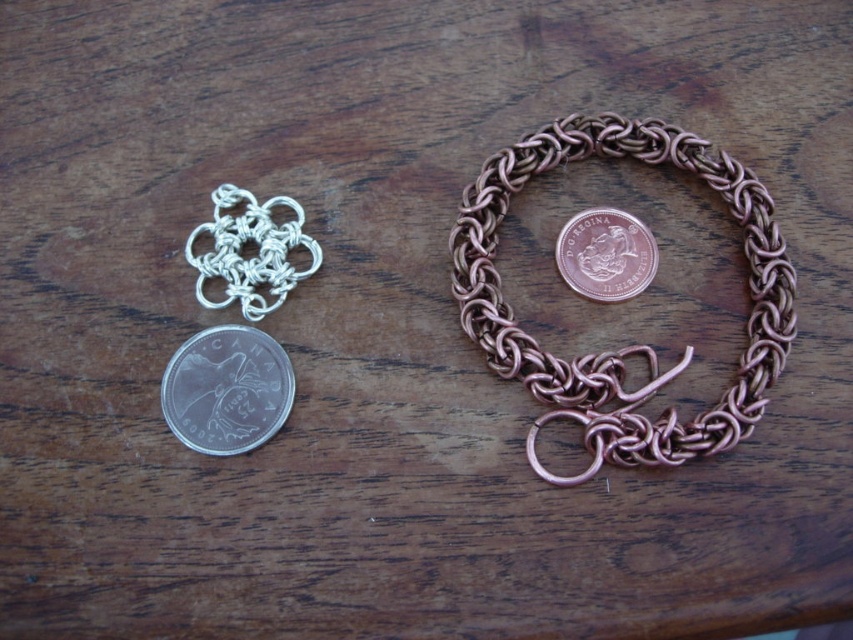
Question: Which of the following is the closest to the observer?

Choices:
 (A) rose gold metallic coin at center
 (B) silver/metallic chain at center

Answer: (B)

Question: In this image, where is silver metallic coin at lower left located relative to silver/metallic chain at center?

Choices:
 (A) left
 (B) right

Answer: (A)

Question: Which of the following is the closest to the observer?

Choices:
 (A) (608, 243)
 (B) (234, 352)
 (C) (792, 278)

Answer: (C)

Question: In this image, where is copper wire bracelet at center located relative to rose gold metallic coin at center?

Choices:
 (A) below
 (B) above

Answer: (A)

Question: Which of the following is the farthest from the observer?

Choices:
 (A) (202, 225)
 (B) (173, 406)
 (C) (631, 268)
 (D) (744, 188)

Answer: (C)

Question: Does copper wire bracelet at center appear under silver metallic coin at lower left?

Choices:
 (A) yes
 (B) no

Answer: (B)